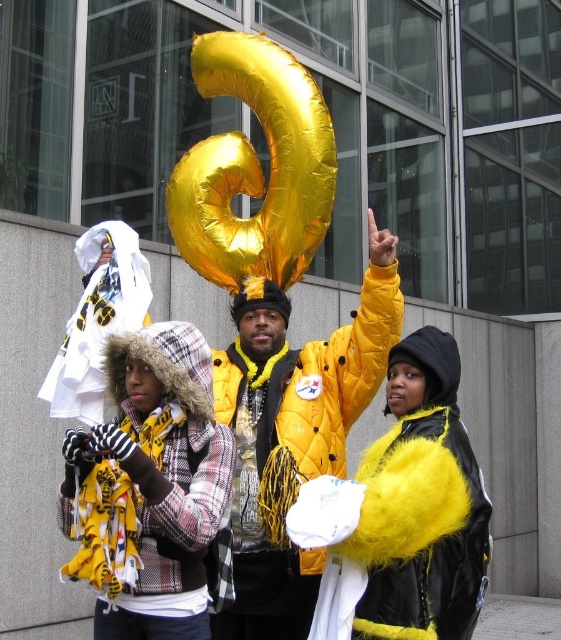
Question: Which point appears farthest from the camera in this image?

Choices:
 (A) (205, 412)
 (B) (399, 467)

Answer: (A)

Question: Estimate the real-world distances between objects in this image. Which object is farther from the gold metallic balloon at center?

Choices:
 (A) yellow quilted jacket at center
 (B) plaid fabric hooded jacket at left

Answer: (A)

Question: Is fuzzy yellow jacket at center wider than gold metallic balloon at center?

Choices:
 (A) no
 (B) yes

Answer: (A)

Question: From the image, what is the correct spatial relationship of plaid fabric hooded jacket at left in relation to gold metallic balloon at center?

Choices:
 (A) below
 (B) above

Answer: (A)

Question: Which point is closer to the camera?

Choices:
 (A) (211, 180)
 (B) (160, 339)

Answer: (B)

Question: Is fuzzy yellow jacket at center bigger than gold metallic balloon at center?

Choices:
 (A) no
 (B) yes

Answer: (A)